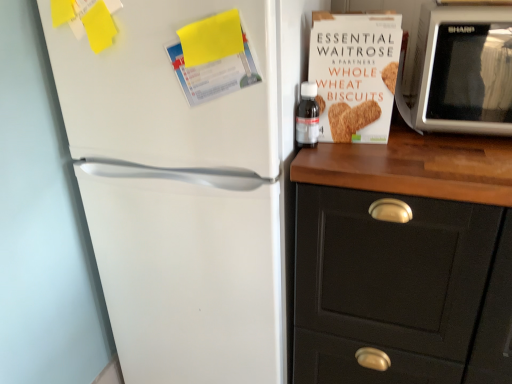
Question: From the image's perspective, is white cardboard box of whole wheat biscuits at upper right on black matte cabinet at right?

Choices:
 (A) yes
 (B) no

Answer: (A)

Question: Is white cardboard box of whole wheat biscuits at upper right positioned with its back to black matte cabinet at right?

Choices:
 (A) yes
 (B) no

Answer: (B)

Question: From a real-world perspective, is white cardboard box of whole wheat biscuits at upper right below black matte cabinet at right?

Choices:
 (A) yes
 (B) no

Answer: (B)

Question: Is white cardboard box of whole wheat biscuits at upper right bigger than black matte cabinet at right?

Choices:
 (A) no
 (B) yes

Answer: (A)

Question: Is white cardboard box of whole wheat biscuits at upper right next to black matte cabinet at right?

Choices:
 (A) yes
 (B) no

Answer: (B)

Question: Does point (379, 211) appear closer or farther from the camera than point (302, 107)?

Choices:
 (A) farther
 (B) closer

Answer: (B)

Question: Based on their positions, is black matte cabinet at right located to the left or right of transparent plastic bottle at upper right?

Choices:
 (A) left
 (B) right

Answer: (B)

Question: Is black matte cabinet at right spatially inside transparent plastic bottle at upper right, or outside of it?

Choices:
 (A) inside
 (B) outside

Answer: (B)

Question: Looking at the image, does black matte cabinet at right seem bigger or smaller compared to transparent plastic bottle at upper right?

Choices:
 (A) big
 (B) small

Answer: (A)

Question: Considering the positions of transparent plastic bottle at upper right and white plastic microwave at upper right in the image, is transparent plastic bottle at upper right taller or shorter than white plastic microwave at upper right?

Choices:
 (A) tall
 (B) short

Answer: (B)

Question: Considering the positions of transparent plastic bottle at upper right and white plastic microwave at upper right in the image, is transparent plastic bottle at upper right wider or thinner than white plastic microwave at upper right?

Choices:
 (A) thin
 (B) wide

Answer: (A)

Question: Considering the positions of point (309, 91) and point (439, 6), is point (309, 91) closer or farther from the camera than point (439, 6)?

Choices:
 (A) farther
 (B) closer

Answer: (A)

Question: Looking at the image, does transparent plastic bottle at upper right seem bigger or smaller compared to white plastic microwave at upper right?

Choices:
 (A) big
 (B) small

Answer: (B)

Question: Which is correct: transparent plastic bottle at upper right is inside white cardboard box of whole wheat biscuits at upper right, or outside of it?

Choices:
 (A) outside
 (B) inside

Answer: (A)

Question: From the image's perspective, is transparent plastic bottle at upper right above or below white cardboard box of whole wheat biscuits at upper right?

Choices:
 (A) above
 (B) below

Answer: (B)